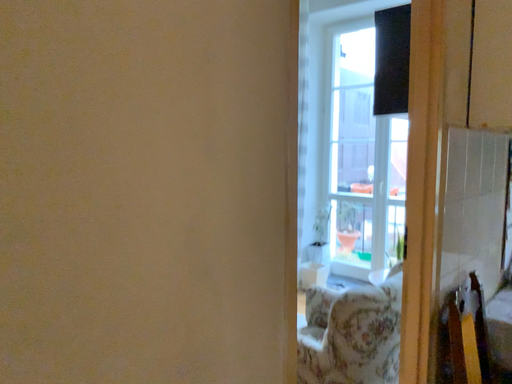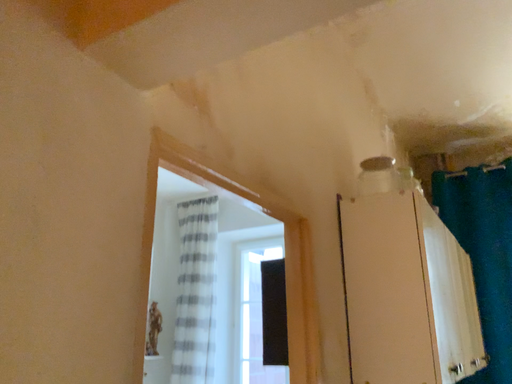
Question: How did the camera likely rotate when shooting the video?

Choices:
 (A) rotated right
 (B) rotated left

Answer: (A)